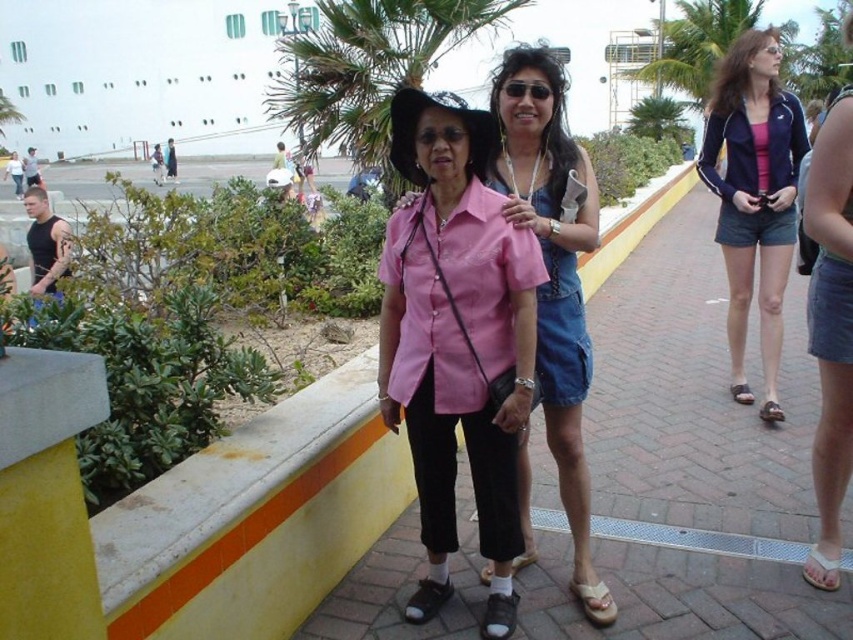
Question: Which is farther from the pink fabric shirt at center?

Choices:
 (A) light brown leather sandal at lower right
 (B) black fabric sandal at lower center
 (C) navy blue jacket at upper right

Answer: (C)

Question: Considering the relative positions of pink matte shirt at center and black fabric sandal at lower center in the image provided, where is pink matte shirt at center located with respect to black fabric sandal at lower center?

Choices:
 (A) above
 (B) below

Answer: (A)

Question: Does pink matte shirt at center have a greater width compared to matte black sandal at lower right?

Choices:
 (A) no
 (B) yes

Answer: (B)

Question: Which object is the closest to the matte black sunglasses at center?

Choices:
 (A) pink fabric shirt at center
 (B) black leather sandal at center
 (C) white glossy cruise ship at upper center
 (D) beige fabric sandal at lower center

Answer: (D)

Question: Which object appears closest to the camera in this image?

Choices:
 (A) brown leather sandal at lower right
 (B) denim skirt at right
 (C) pink matte shirt at center

Answer: (C)

Question: In this image, where is navy blue jacket at upper right located relative to beige fabric sandal at lower center?

Choices:
 (A) left
 (B) right

Answer: (B)